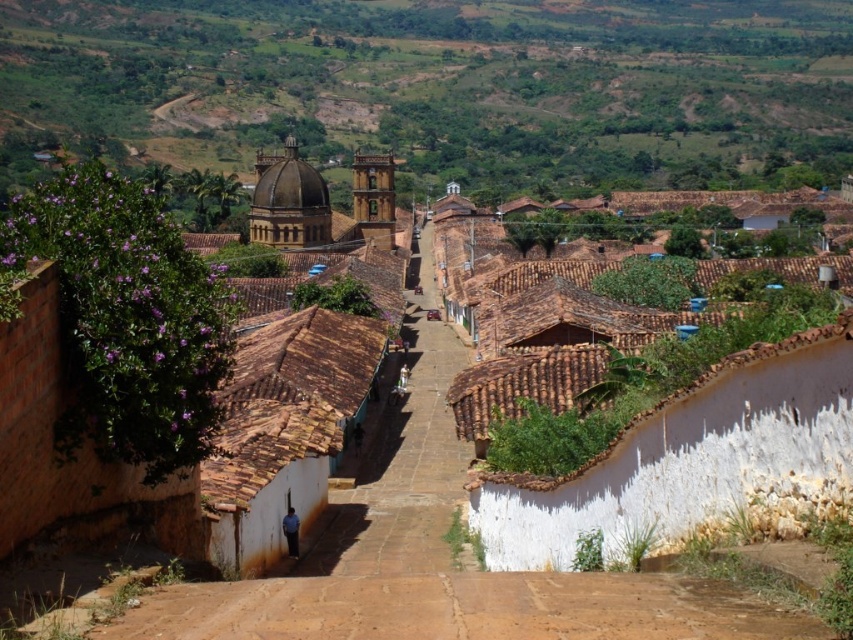
Question: Does green grassy hillside at upper center appear on the left side of brown earthy dirt track at center?

Choices:
 (A) yes
 (B) no

Answer: (B)

Question: Which of the following is the closest to the observer?

Choices:
 (A) green grassy hillside at upper center
 (B) brown earthy dirt track at center
 (C) brown tiled path at center

Answer: (B)

Question: Is green grassy hillside at upper center positioned in front of brown tiled path at center?

Choices:
 (A) yes
 (B) no

Answer: (B)

Question: Among these objects, which one is nearest to the camera?

Choices:
 (A) brown tiled path at center
 (B) green grassy hillside at upper center
 (C) brown earthy dirt track at center

Answer: (C)

Question: From the image, what is the correct spatial relationship of green grassy hillside at upper center in relation to brown tiled path at center?

Choices:
 (A) below
 (B) above

Answer: (B)

Question: Which of these objects is positioned closest to the brown earthy dirt track at center?

Choices:
 (A) green grassy hillside at upper center
 (B) brown tiled path at center

Answer: (B)